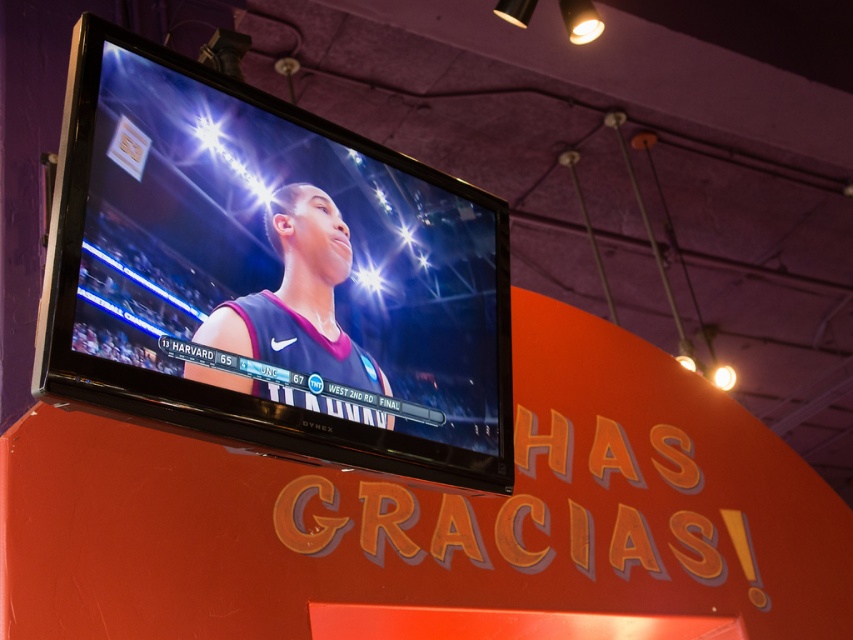
From the picture: Is the position of matte black tv at upper center more distant than that of matte black jersey at center?

No, matte black tv at upper center is in front of matte black jersey at center.

Which is behind, point (187, 241) or point (199, 337)?

Positioned behind is point (187, 241).

This screenshot has height=640, width=853. What are the coordinates of `matte black tv at upper center` in the screenshot? It's located at (270, 275).